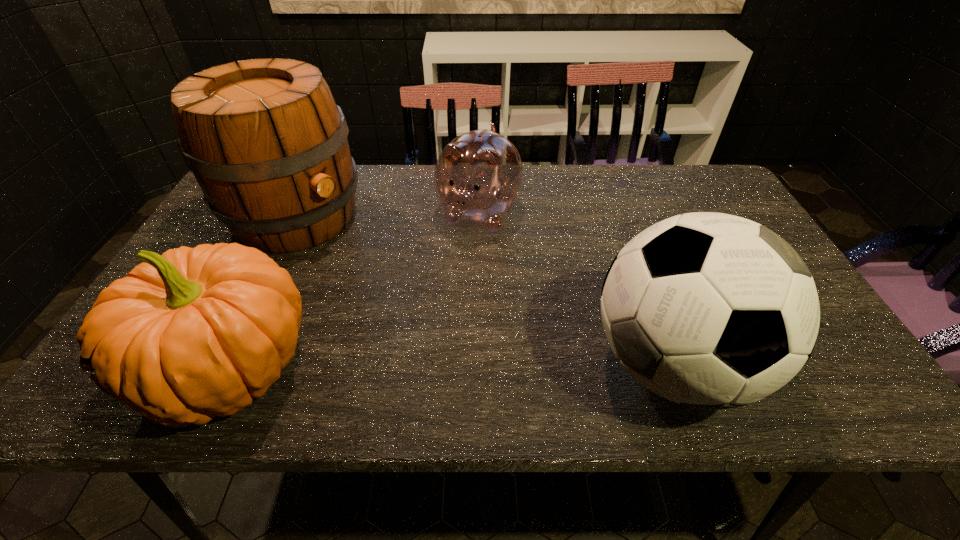
I want to click on blank area located 0.140m on the front facing side of the shortest object, so click(445, 276).

Identify the location of vacant space positioned on the front facing side of the shortest object. The image size is (960, 540). (423, 318).

Where is `cider located in the far edge section of the desktop`? The image size is (960, 540). cider located in the far edge section of the desktop is located at coordinates click(265, 140).

Find the location of a particular element. The height and width of the screenshot is (540, 960). piggy bank located in the far edge section of the desktop is located at coordinates (478, 176).

Where is `pumpkin present at the near edge`? pumpkin present at the near edge is located at coordinates (194, 333).

Locate an element on the screen. The width and height of the screenshot is (960, 540). soccer ball at the near edge is located at coordinates (714, 311).

Where is `pumpkin located at the left edge`? This screenshot has height=540, width=960. pumpkin located at the left edge is located at coordinates (194, 333).

This screenshot has width=960, height=540. Identify the location of cider positioned at the left edge. click(x=265, y=140).

I want to click on object present at the far left corner, so click(265, 140).

Locate an element on the screen. The width and height of the screenshot is (960, 540). object that is at the near left corner is located at coordinates (194, 333).